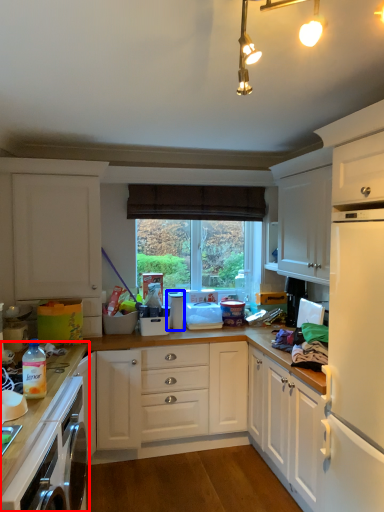
Question: Which point is further to the camera, countertop (highlighted by a red box) or appliance (highlighted by a blue box)?

Choices:
 (A) countertop
 (B) appliance

Answer: (B)